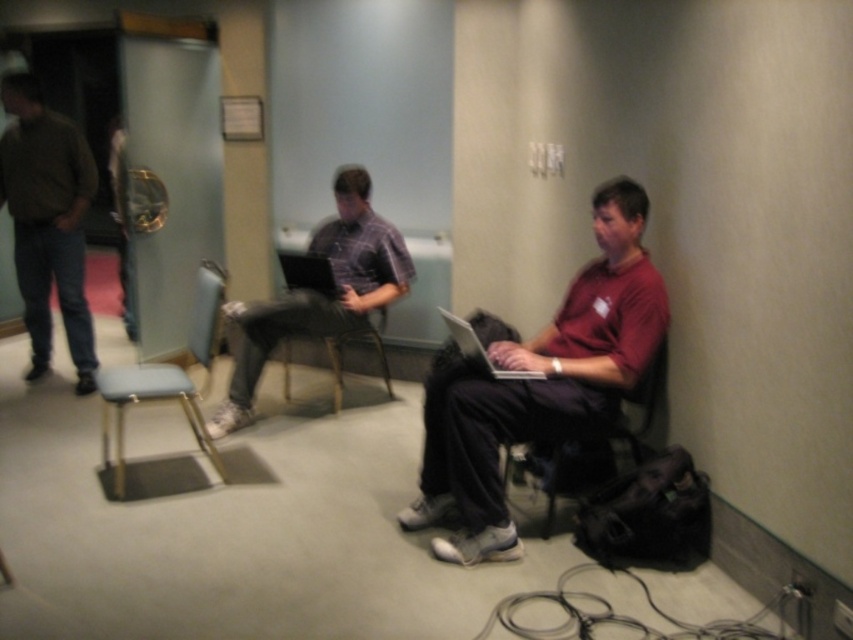
Question: Which object is the farthest from the matte red shirt at center?

Choices:
 (A) plaid fabric shirt at center
 (B) silver metallic laptop at center

Answer: (A)

Question: Which point is closer to the camera?

Choices:
 (A) (506, 448)
 (B) (521, 372)
 (C) (289, 280)
 (D) (291, 307)

Answer: (B)

Question: Can you confirm if matte red shirt at center is smaller than black plastic chair at center?

Choices:
 (A) no
 (B) yes

Answer: (A)

Question: Observing the image, what is the correct spatial positioning of plaid fabric shirt at center in reference to light blue fabric stool at lower left?

Choices:
 (A) left
 (B) right

Answer: (B)

Question: Can you confirm if plaid fabric shirt at center is thinner than matte black laptop at center?

Choices:
 (A) yes
 (B) no

Answer: (B)

Question: Among these objects, which one is nearest to the camera?

Choices:
 (A) matte red shirt at center
 (B) black plastic chair at center
 (C) matte black laptop at center
 (D) silver metallic laptop at center

Answer: (D)